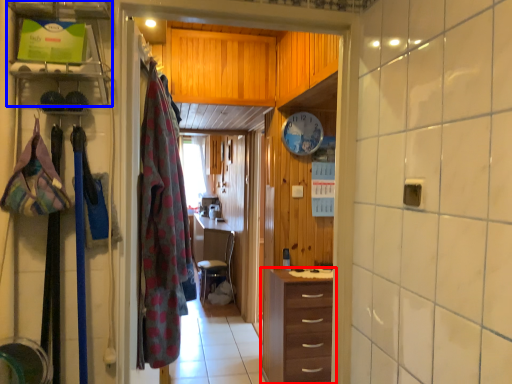
Question: Among these objects, which one is nearest to the camera, chest of drawers (highlighted by a red box) or shelf (highlighted by a blue box)?

Choices:
 (A) chest of drawers
 (B) shelf

Answer: (B)